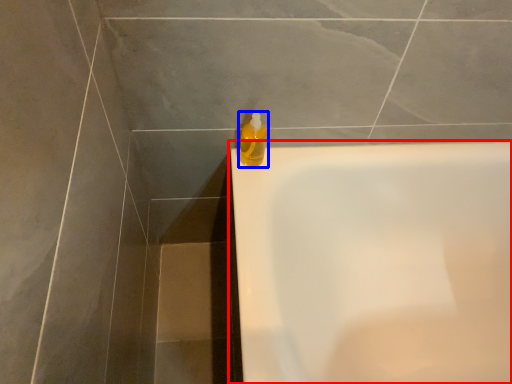
Question: Which object is further to the camera taking this photo, bathtub (highlighted by a red box) or cleaning product (highlighted by a blue box)?

Choices:
 (A) bathtub
 (B) cleaning product

Answer: (B)